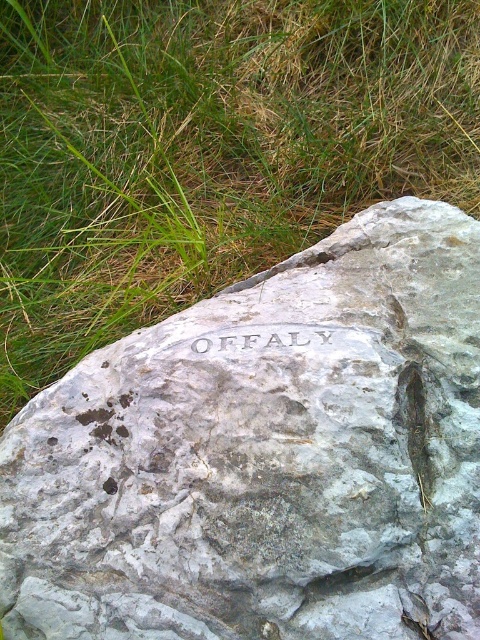
Question: Which of these objects is positioned closest to the gray stone engraving at center?

Choices:
 (A) green grass at upper left
 (B) gray stone boulder at center

Answer: (B)

Question: Is gray stone boulder at center closer to camera compared to gray stone engraving at center?

Choices:
 (A) no
 (B) yes

Answer: (B)

Question: Based on their relative distances, which object is nearer to the gray stone boulder at center?

Choices:
 (A) green grass at upper left
 (B) gray stone engraving at center

Answer: (B)

Question: Which object appears closest to the camera in this image?

Choices:
 (A) gray stone engraving at center
 (B) green grass at upper left
 (C) gray stone boulder at center

Answer: (C)

Question: Does green grass at upper left have a smaller size compared to gray stone engraving at center?

Choices:
 (A) no
 (B) yes

Answer: (A)

Question: Does gray stone boulder at center have a smaller size compared to green grass at upper left?

Choices:
 (A) yes
 (B) no

Answer: (A)